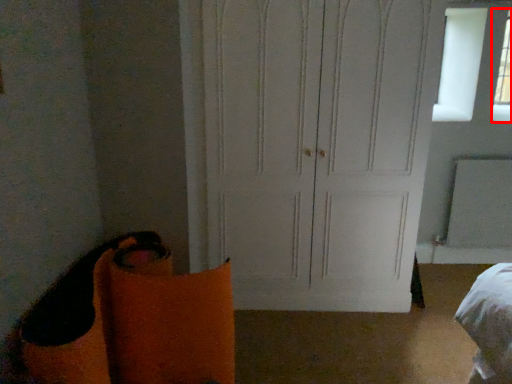
Question: From the image's perspective, considering the relative positions of window (annotated by the red box) and door in the image provided, where is window (annotated by the red box) located with respect to the staircase?

Choices:
 (A) below
 (B) above

Answer: (B)